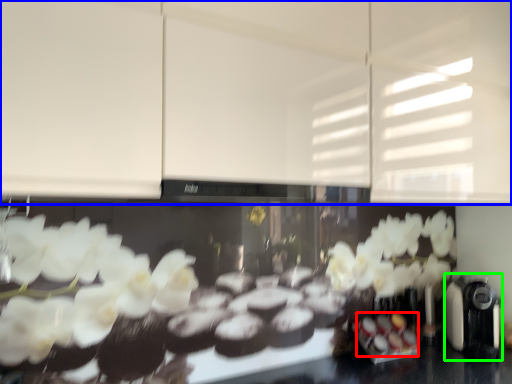
Question: Considering the real-world distances, which object is closest to food (highlighted by a red box)? cabinetry (highlighted by a blue box) or coffee machine (highlighted by a green box).

Choices:
 (A) cabinetry
 (B) coffee machine

Answer: (B)